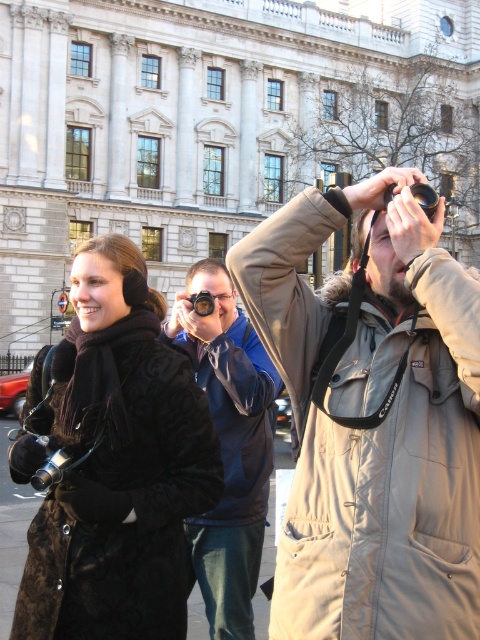
Can you confirm if black fur coat at center is wider than blue fabric jacket at center?

No.

This screenshot has height=640, width=480. I want to click on black fur coat at center, so click(x=113, y=464).

The height and width of the screenshot is (640, 480). What are the coordinates of `black fur coat at center` in the screenshot? It's located at (113, 464).

Who is taller, tan fabric coat at upper right or blue fabric jacket at center?

With more height is tan fabric coat at upper right.

Between tan fabric coat at upper right and blue fabric jacket at center, which one appears on the left side from the viewer's perspective?

blue fabric jacket at center

Who is more distant from viewer, (448, 436) or (214, 627)?

Positioned behind is point (214, 627).

The width and height of the screenshot is (480, 640). I want to click on tan fabric coat at upper right, so click(x=375, y=426).

Does tan fabric coat at upper right have a lesser width compared to black fur coat at center?

No.

Between point (456, 552) and point (84, 266), which one is positioned in front?

Point (456, 552)

Identify the location of tan fabric coat at upper right. (375, 426).